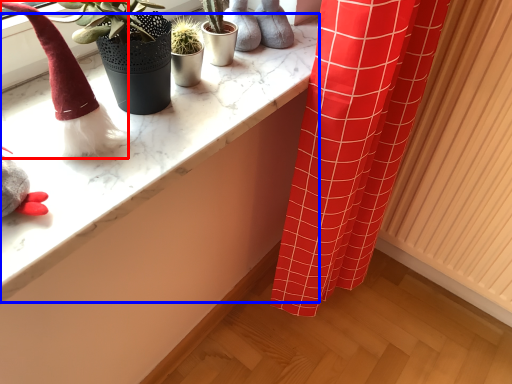
Question: Which of the following is the closest to the observer, toy (highlighted by a red box) or counter top (highlighted by a blue box)?

Choices:
 (A) toy
 (B) counter top

Answer: (A)